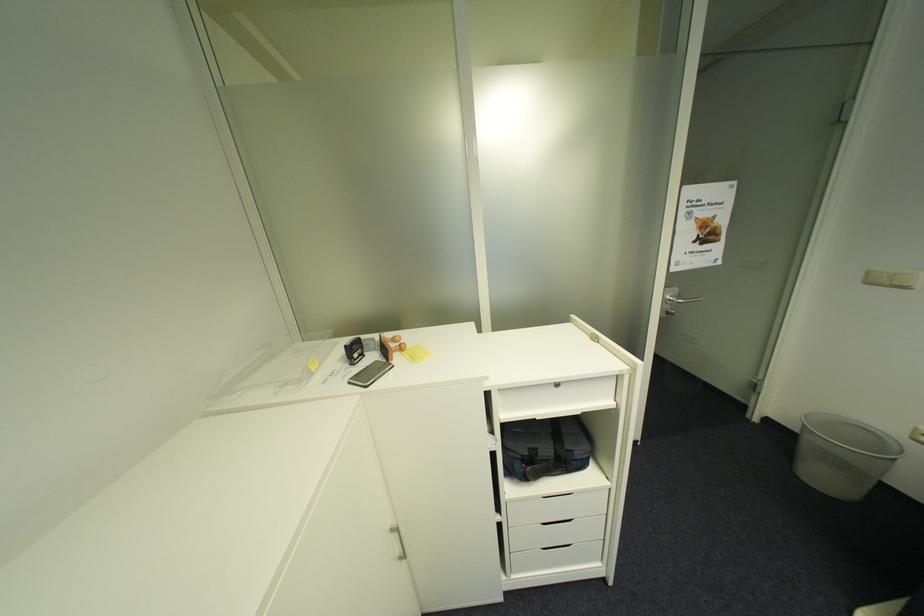
The width and height of the screenshot is (924, 616). Describe the element at coordinates (674, 301) in the screenshot. I see `the silver door handle` at that location.